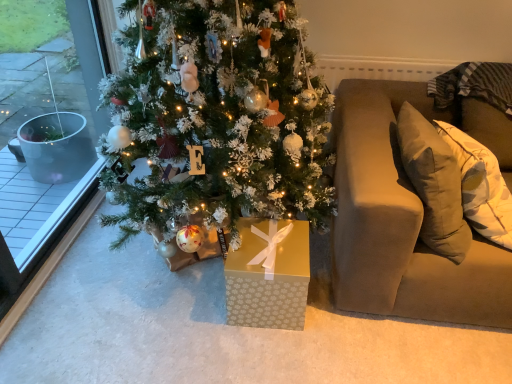
Locate an element on the screen. This screenshot has width=512, height=384. free spot to the right of gold paper gift box at center is located at coordinates (334, 309).